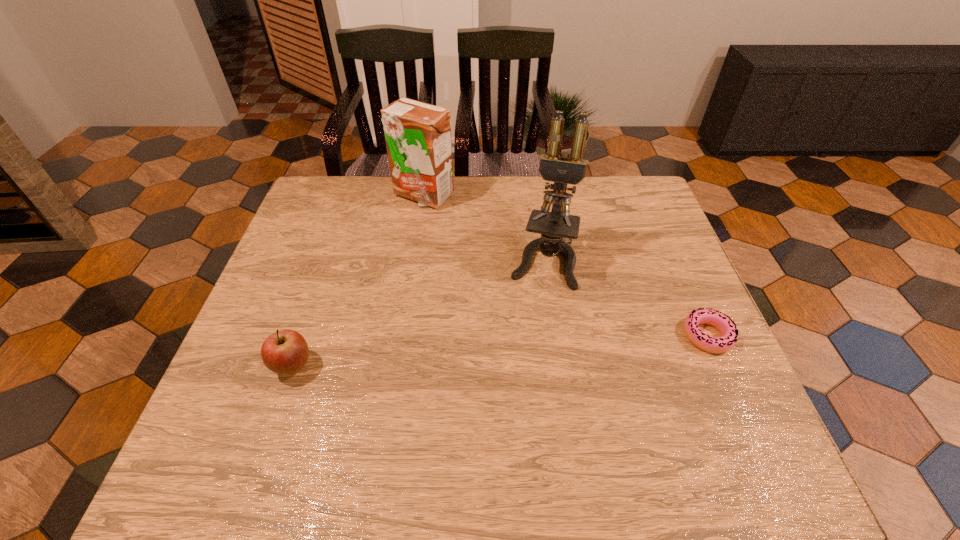
This screenshot has height=540, width=960. In order to click on free spot between the leftmost object and the rightmost object in this screenshot , I will do `click(500, 351)`.

Where is `vacant area between the microscope and the doughnut`? vacant area between the microscope and the doughnut is located at coordinates (625, 298).

You are a GUI agent. You are given a task and a screenshot of the screen. Output one action in this format:
    pyautogui.click(x=<x>, y=<y>)
    Task: Click on the vacant area that lies between the second tallest object and the tallest object
    The width and height of the screenshot is (960, 540).
    Given the screenshot: What is the action you would take?
    pyautogui.click(x=483, y=228)

Select which object is the closest to the third tallest object. Please provide its 2D coordinates. Your answer should be formatted as a tuple, i.e. [(x, y)], where the tuple contains the x and y coordinates of a point satisfying the conditions above.

[(557, 228)]

Identify which object is the third nearest to the third object from left to right. Please provide its 2D coordinates. Your answer should be formatted as a tuple, i.e. [(x, y)], where the tuple contains the x and y coordinates of a point satisfying the conditions above.

[(285, 352)]

Locate an element on the screen. The image size is (960, 540). free location that satisfies the following two spatial constraints: 1. on the front side of the third nearest object; 2. on the right side of the rightmost object is located at coordinates (554, 335).

In order to click on blank area in the image that satisfies the following two spatial constraints: 1. on the front side of the carton; 2. on the right side of the shortest object in this screenshot , I will do `click(402, 335)`.

Where is `blank area in the image that satisfies the following two spatial constraints: 1. on the front side of the second object from right to left; 2. on the left side of the carton`? This screenshot has height=540, width=960. blank area in the image that satisfies the following two spatial constraints: 1. on the front side of the second object from right to left; 2. on the left side of the carton is located at coordinates (413, 260).

Where is `vacant space that satisfies the following two spatial constraints: 1. on the front side of the carton; 2. on the right side of the second object from right to left`? vacant space that satisfies the following two spatial constraints: 1. on the front side of the carton; 2. on the right side of the second object from right to left is located at coordinates (413, 260).